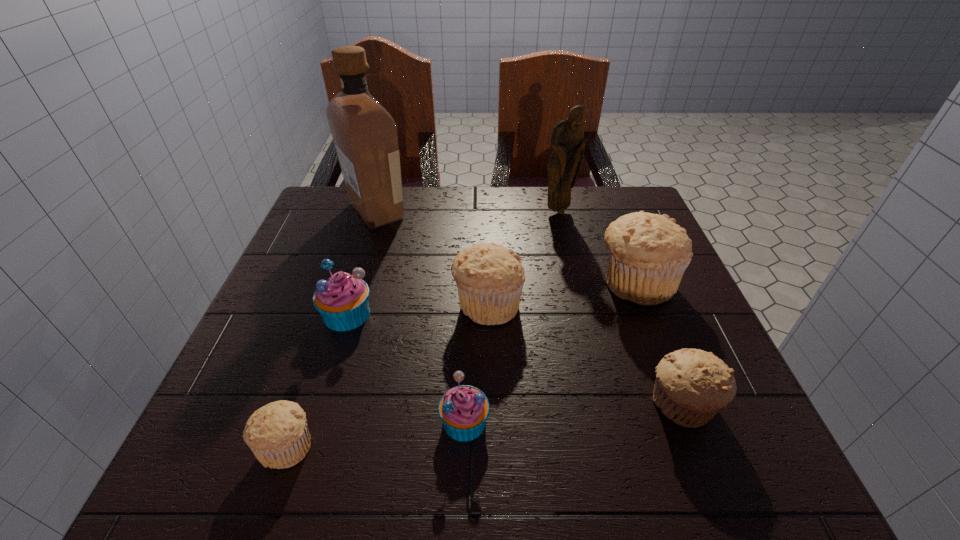
Locate an element on the screen. This screenshot has height=540, width=960. free space between the third biggest beige muffin and the tallest muffin is located at coordinates (658, 344).

In order to click on empty space that is in between the third biggest beige muffin and the second beige muffin from left to right in this screenshot , I will do `click(584, 355)`.

Locate an element on the screen. Image resolution: width=960 pixels, height=540 pixels. free space between the tallest object and the smaller blue muffin is located at coordinates (420, 316).

The width and height of the screenshot is (960, 540). In order to click on free spot between the figurine and the brown liquor in this screenshot , I will do `click(468, 211)`.

This screenshot has width=960, height=540. I want to click on vacant area that lies between the second smallest beige muffin and the tallest object, so click(528, 308).

Where is `object that is the seventh closest to the smallest beige muffin`? This screenshot has height=540, width=960. object that is the seventh closest to the smallest beige muffin is located at coordinates (567, 143).

Identify which object is the fourth nearest to the farther blue muffin. Please provide its 2D coordinates. Your answer should be formatted as a tuple, i.e. [(x, y)], where the tuple contains the x and y coordinates of a point satisfying the conditions above.

[(365, 135)]

Locate which muffin is the fifth closest to the second tallest object. Please provide its 2D coordinates. Your answer should be formatted as a tuple, i.e. [(x, y)], where the tuple contains the x and y coordinates of a point satisfying the conditions above.

[(464, 409)]

Identify which muffin is the third closest to the tallest object. Please provide its 2D coordinates. Your answer should be formatted as a tuple, i.e. [(x, y)], where the tuple contains the x and y coordinates of a point satisfying the conditions above.

[(648, 253)]

Locate an element on the screen. This screenshot has width=960, height=540. the third closest beige muffin to the fourth tallest object is located at coordinates (277, 433).